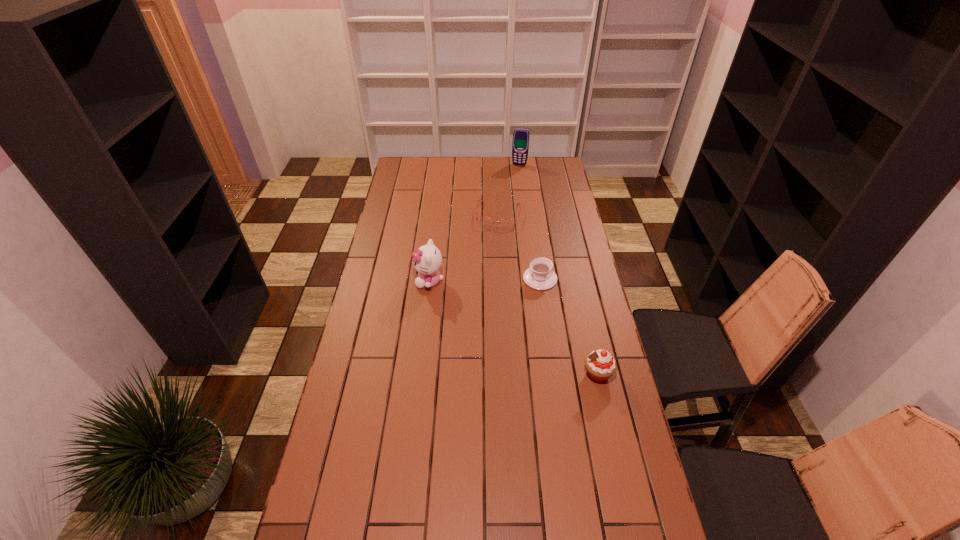
I want to click on free space on the desktop that is between the leftmost object and the nearest object and is positioned on the lenses of the fourth nearest object, so click(x=482, y=310).

Find the location of a particular element. The height and width of the screenshot is (540, 960). free space on the desktop that is between the kitten and the cupcake and is positioned on the handle side of the fourth tallest object is located at coordinates (491, 315).

I want to click on free space on the desktop that is between the leftmost object and the rightmost object and is positioned on the front-facing side of the cellular telephone, so click(492, 315).